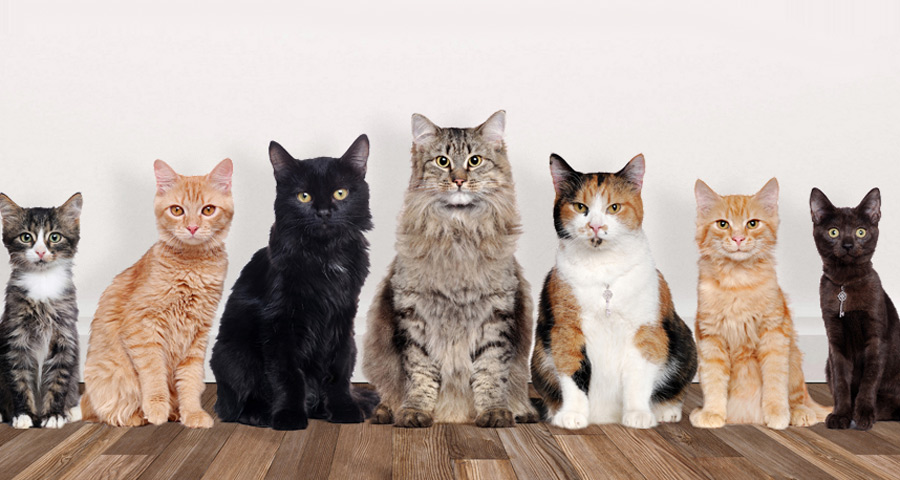
Where is `chest`? chest is located at coordinates click(40, 321), click(184, 307), click(333, 295), click(454, 293), click(605, 299), click(734, 310), click(842, 315).